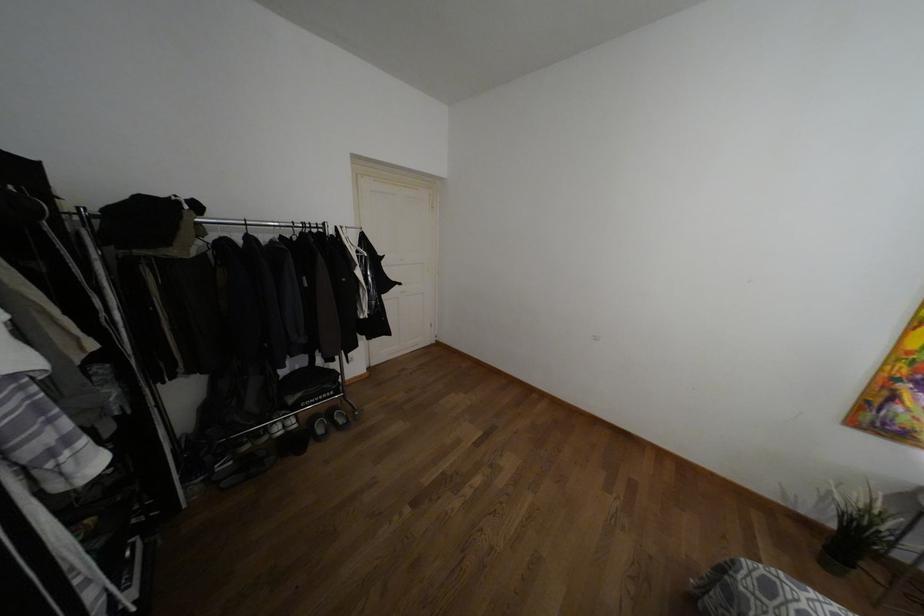
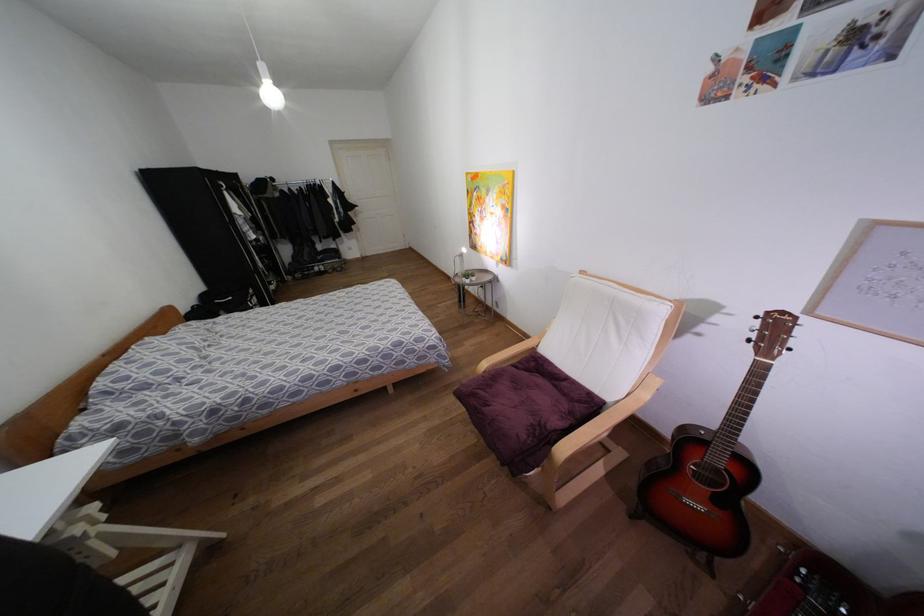
Which direction would the cameraman need to move to produce the second image?

The cameraman moved toward right, backward.